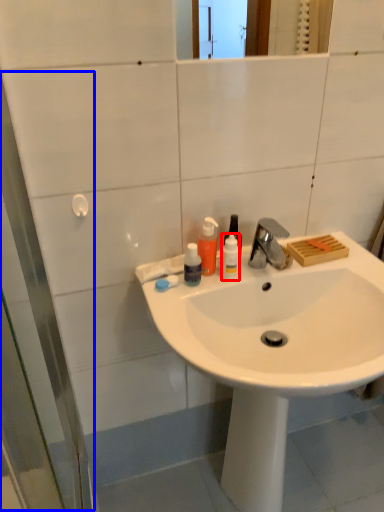
Question: Which of the following is the closest to the observer, bottle (highlighted by a red box) or screen door (highlighted by a blue box)?

Choices:
 (A) bottle
 (B) screen door

Answer: (B)